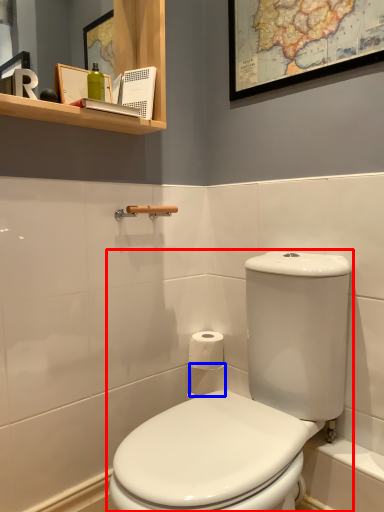
Question: Which object appears closest to the camera in this image, toilet (highlighted by a red box) or toilet paper (highlighted by a blue box)?

Choices:
 (A) toilet
 (B) toilet paper

Answer: (A)